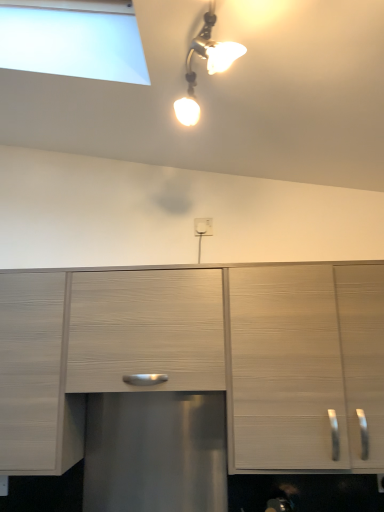
Question: Relative to light wood cabinet at right, the first cabinetry when ordered from right to left, is white plastic electric outlet at center in front or behind?

Choices:
 (A) behind
 (B) front

Answer: (A)

Question: Looking at the image, does white plastic electric outlet at center seem bigger or smaller compared to light wood cabinet at right, the second cabinetry when ordered from left to right?

Choices:
 (A) small
 (B) big

Answer: (A)

Question: Which object is the farthest from the white plastic electric outlet at center?

Choices:
 (A) light wood cabinet at right, the second cabinetry when ordered from left to right
 (B) light wood drawer at center
 (C) matte wood cabinet at left, the first cabinetry when ordered from left to right

Answer: (C)

Question: Estimate the real-world distances between objects in this image. Which object is closer to the light wood drawer at center?

Choices:
 (A) matte wood cabinet at left, the first cabinetry when ordered from left to right
 (B) white plastic electric outlet at center
 (C) light wood cabinet at right, the first cabinetry when ordered from right to left

Answer: (A)